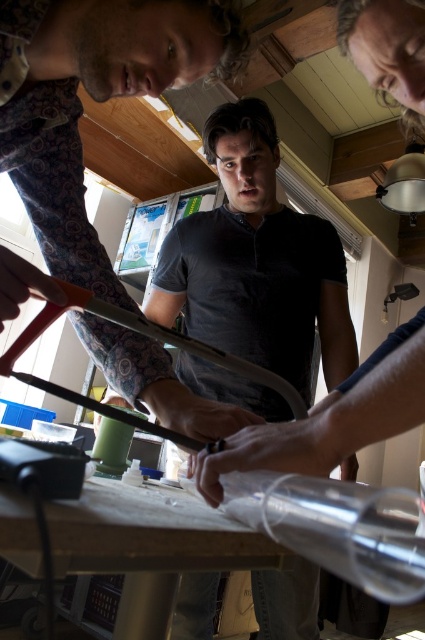
Is wooden table at center to the left of orange plastic ruler at center from the viewer's perspective?

Correct, you'll find wooden table at center to the left of orange plastic ruler at center.

Does wooden table at center have a greater height compared to orange plastic ruler at center?

Incorrect, wooden table at center's height is not larger of orange plastic ruler at center's.

Does point (34, 525) lie in front of point (146, 326)?

Yes, point (34, 525) is in front of point (146, 326).

Identify the location of wooden table at center. (150, 532).